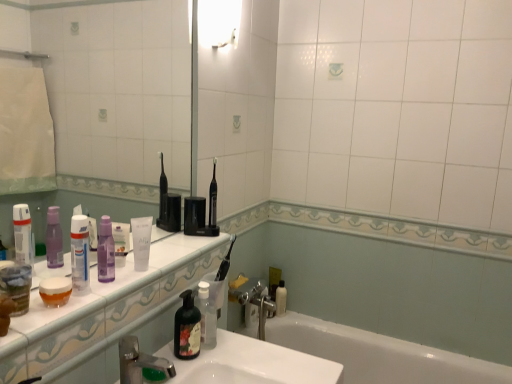
Identify the location of empty space that is to the right of green matte soap dispenser at center, arranged as the 3th toiletry when viewed from the front. (245, 357).